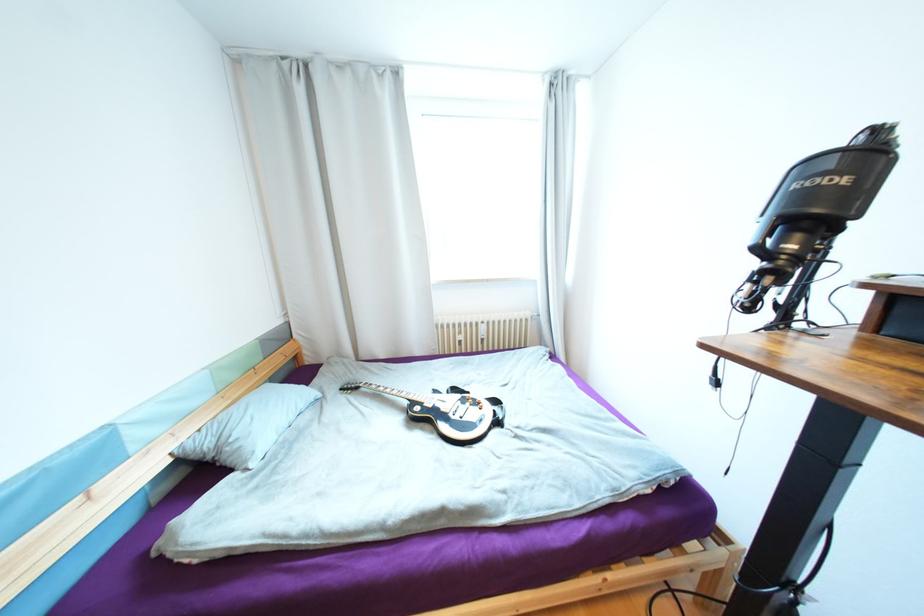
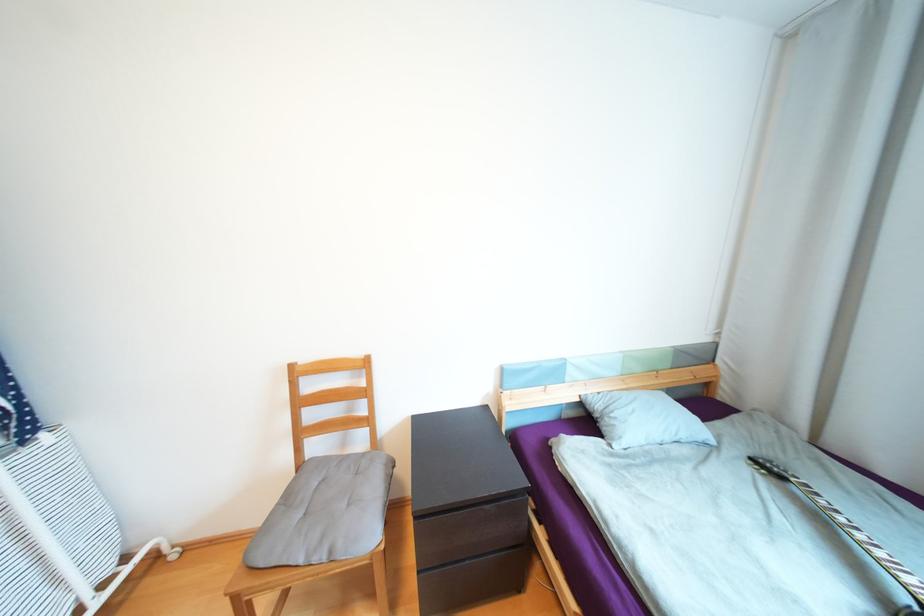
In the second image, find the point that corresponds to (x=362, y=389) in the first image.

(787, 477)